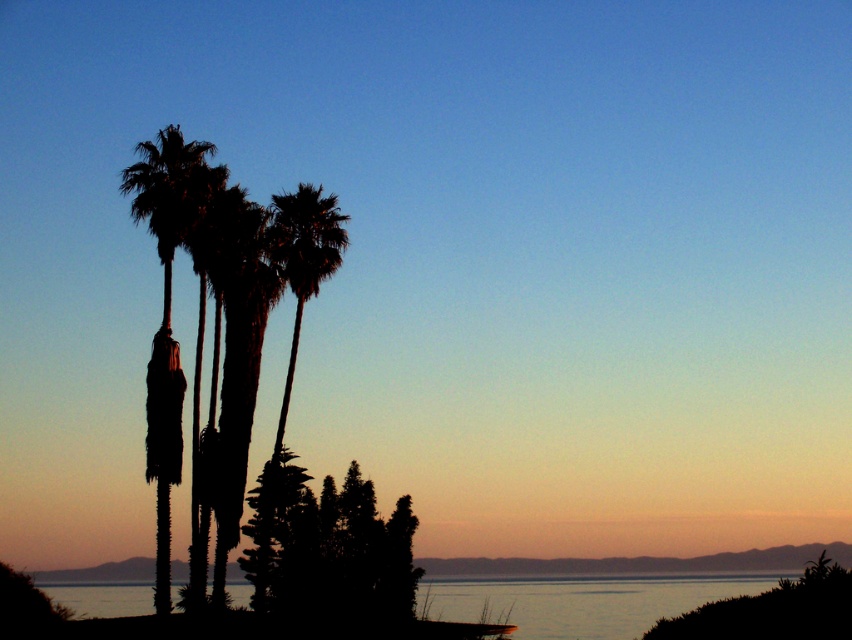
Can you confirm if silhouette leafy tree at center is bigger than silhouette palm tree at center?

No, silhouette leafy tree at center is not bigger than silhouette palm tree at center.

Is silhouette leafy tree at center to the left of silhouette palm tree at center from the viewer's perspective?

In fact, silhouette leafy tree at center is to the right of silhouette palm tree at center.

Image resolution: width=852 pixels, height=640 pixels. In order to click on silhouette leafy tree at center in this screenshot , I will do `click(330, 548)`.

The height and width of the screenshot is (640, 852). I want to click on silhouette leafy tree at center, so click(330, 548).

Measure the distance between point (154, 429) and camera.

Point (154, 429) is 163.60 feet from camera.

Can you confirm if silhouette leafy palm at left is wider than silhouette palm tree at center?

Indeed, silhouette leafy palm at left has a greater width compared to silhouette palm tree at center.

Between point (171, 131) and point (295, 230), which one is positioned behind?

Point (295, 230)

The height and width of the screenshot is (640, 852). Identify the location of silhouette leafy palm at left. (167, 307).

Is transparent water at lower center to the left of smooth sand at center from the viewer's perspective?

Correct, you'll find transparent water at lower center to the left of smooth sand at center.

Does transparent water at lower center come behind smooth sand at center?

No.

Who is more forward, (605, 609) or (760, 561)?

Point (605, 609)

You are a GUI agent. You are given a task and a screenshot of the screen. Output one action in this format:
    pyautogui.click(x=<x>, y=<y>)
    Task: Click on the transparent water at lower center
    The width and height of the screenshot is (852, 640).
    Given the screenshot: What is the action you would take?
    pyautogui.click(x=580, y=602)